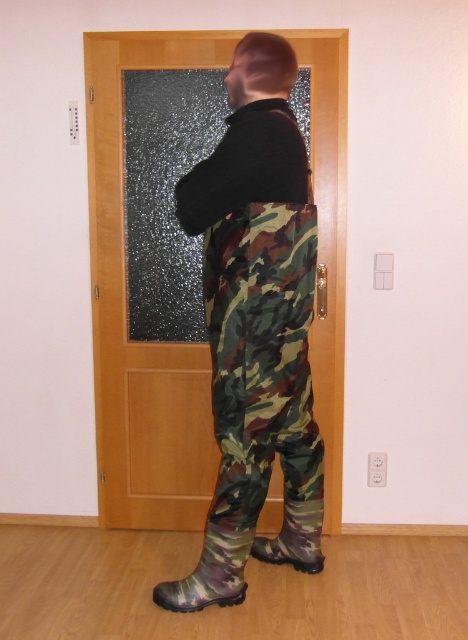
Can you confirm if wooden door at center is thinner than camouflage rubber boot at lower center?

No, wooden door at center is not thinner than camouflage rubber boot at lower center.

Is wooden door at center bigger than camouflage rubber boot at lower center?

Yes, wooden door at center is bigger than camouflage rubber boot at lower center.

Is point (100, 182) farther from camera compared to point (298, 513)?

That is True.

The width and height of the screenshot is (468, 640). Find the location of `wooden door at center`. wooden door at center is located at coordinates (126, 314).